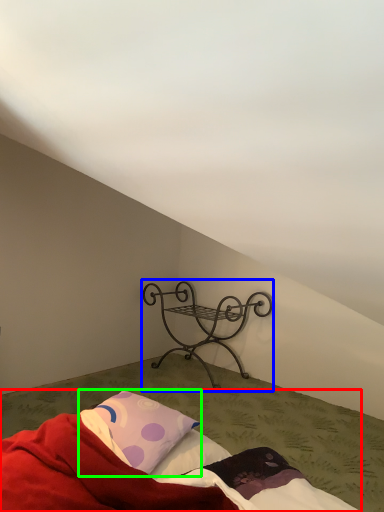
Question: Estimate the real-world distances between objects in this image. Which object is closer to bed (highlighted by a red box), furniture (highlighted by a blue box) or pillow (highlighted by a green box)?

Choices:
 (A) furniture
 (B) pillow

Answer: (B)